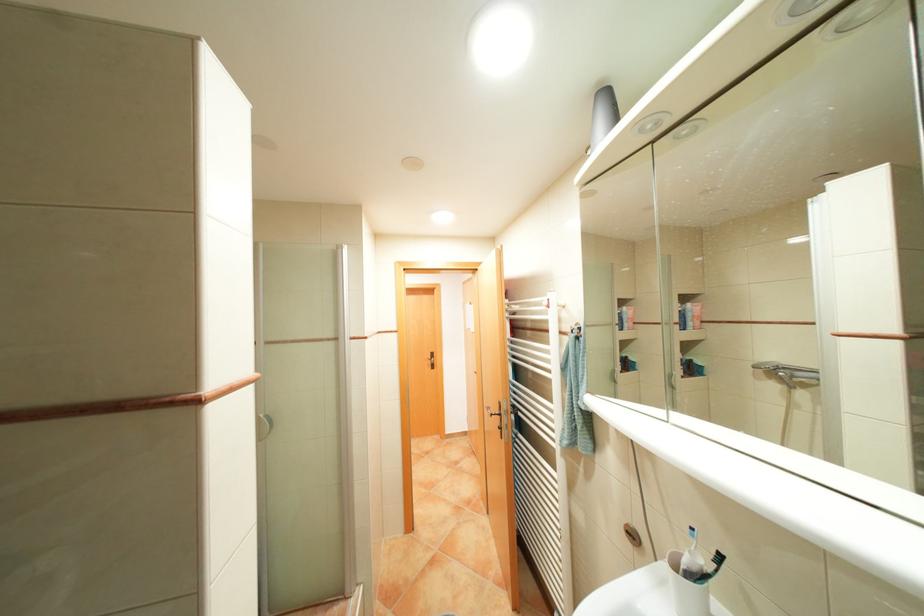
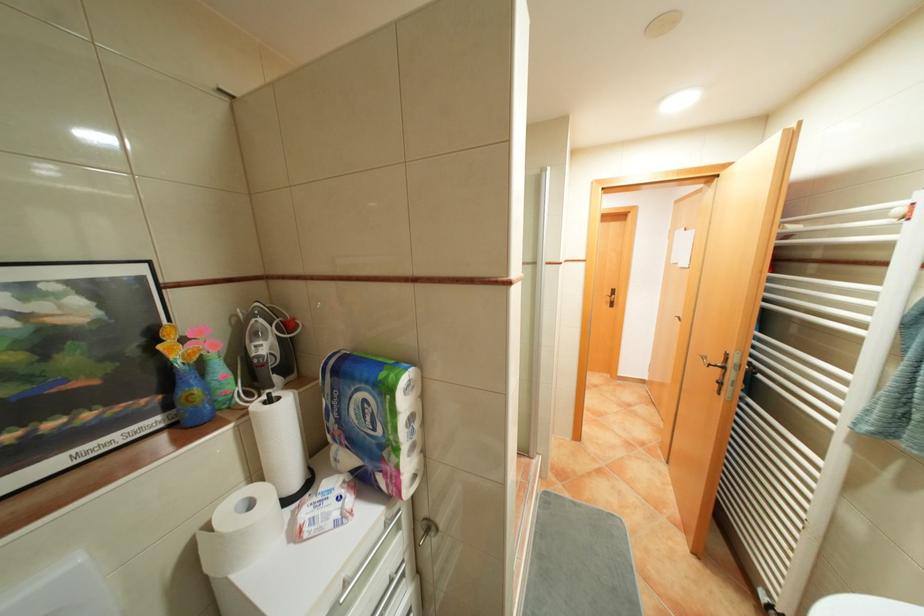
Question: Based on the continuous images, in which direction is the camera rotating? Reply with the corresponding letter.

Choices:
 (A) Left
 (B) Right
 (C) Up
 (D) Down

Answer: (A)